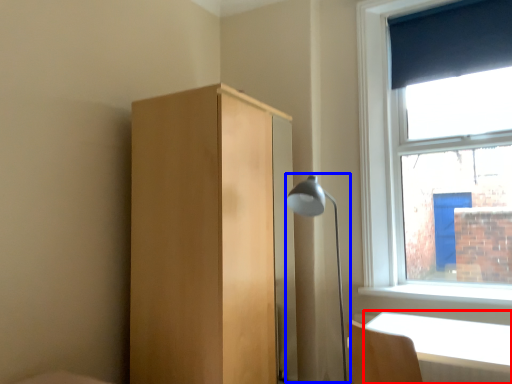
Question: Which object is closer to the camera taking this photo, table (highlighted by a red box) or lamp (highlighted by a blue box)?

Choices:
 (A) table
 (B) lamp

Answer: (A)